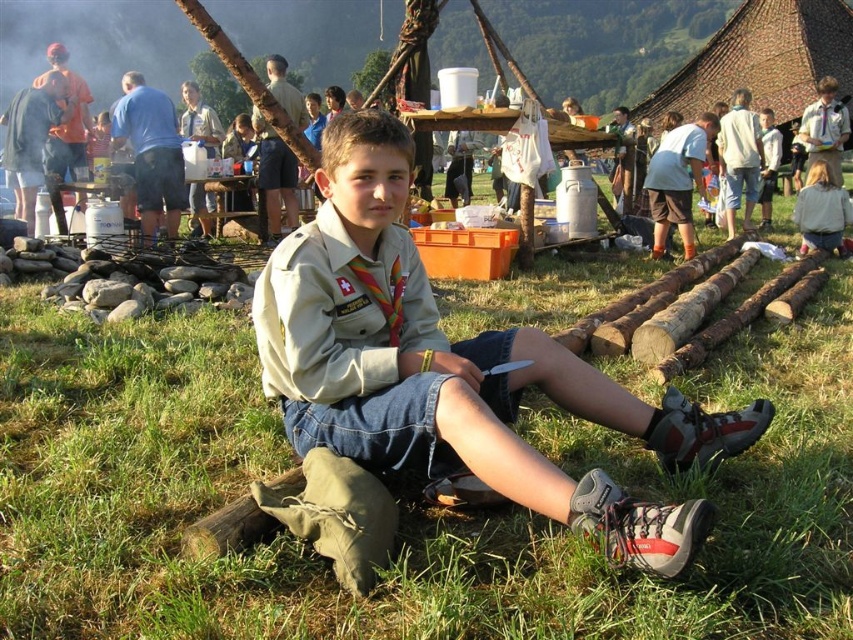
You are a photographer trying to capture a closeup of the green grass at center and the light brown hair at upper right. Which object will appear larger in the photo if you focus on them equally?

The light brown hair at upper right will appear larger in the photo because it is taller than the green grass at center.